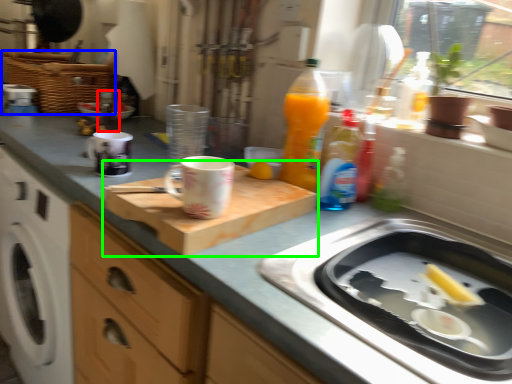
Question: Which object is positioned farthest from bottle (highlighted by a red box)? Select from basket (highlighted by a blue box) and cutting board (highlighted by a green box).

Choices:
 (A) basket
 (B) cutting board

Answer: (B)